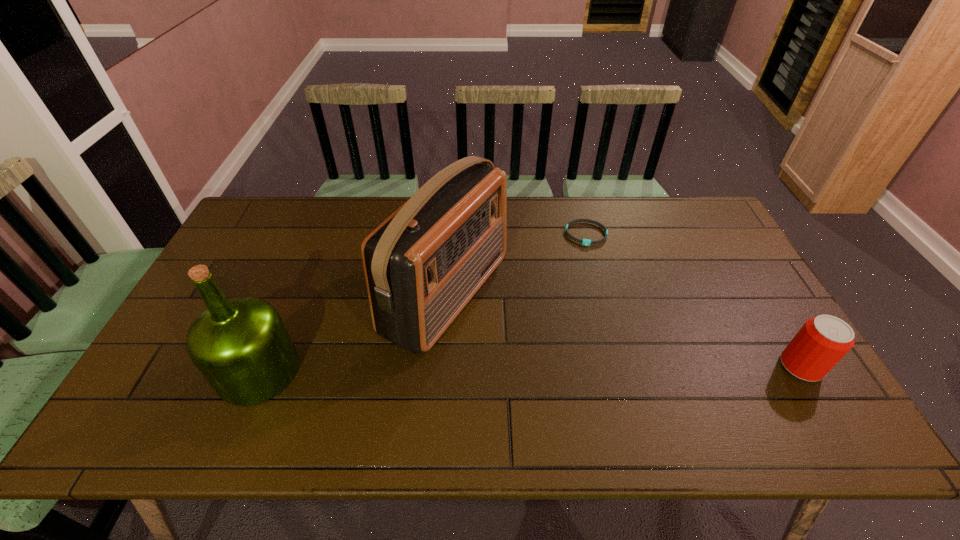
Image resolution: width=960 pixels, height=540 pixels. I want to click on free space located on the front-facing side of the radio receiver, so click(582, 364).

Locate an element on the screen. vacant space located on the buckle of the shortest object is located at coordinates [x=605, y=330].

I want to click on vacant area located 0.120m on the buckle of the shortest object, so click(x=593, y=273).

Find the location of a particular element. This screenshot has height=540, width=960. vacant space located 0.160m on the buckle of the shortest object is located at coordinates (595, 282).

This screenshot has width=960, height=540. In order to click on object present at the far edge in this screenshot , I will do `click(586, 242)`.

Image resolution: width=960 pixels, height=540 pixels. Find the location of `olive oil located in the near edge section of the desktop`. olive oil located in the near edge section of the desktop is located at coordinates (241, 346).

Identify the location of beer can located at the near edge. The height and width of the screenshot is (540, 960). (822, 342).

The image size is (960, 540). Identify the location of object located at the left edge. coord(241,346).

Where is `object situated at the right edge`? The width and height of the screenshot is (960, 540). object situated at the right edge is located at coordinates (822, 342).

You are a GUI agent. You are given a task and a screenshot of the screen. Output one action in this format:
    pyautogui.click(x=<x>, y=<y>)
    Task: Click on the object located at the near left corner
    The height and width of the screenshot is (540, 960).
    Given the screenshot: What is the action you would take?
    241,346